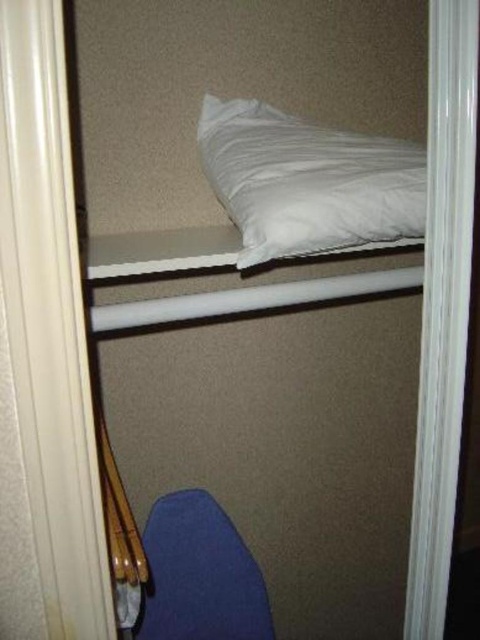
Question: Is blue fabric chair at lower center closer to camera compared to white matte pillow at upper center?

Choices:
 (A) yes
 (B) no

Answer: (B)

Question: Which of the following is the farthest from the observer?

Choices:
 (A) white soft pillow at upper center
 (B) blue fabric chair at lower center
 (C) white matte pillow at upper center

Answer: (B)

Question: In this image, where is white soft pillow at upper center located relative to blue fabric chair at lower center?

Choices:
 (A) right
 (B) left

Answer: (A)

Question: Which object appears farthest from the camera in this image?

Choices:
 (A) blue fabric chair at lower center
 (B) white matte pillow at upper center
 (C) white soft pillow at upper center

Answer: (A)

Question: Does white soft pillow at upper center have a greater width compared to white matte pillow at upper center?

Choices:
 (A) yes
 (B) no

Answer: (B)

Question: Which point is closer to the camera taking this photo?

Choices:
 (A) (219, 134)
 (B) (113, 323)

Answer: (B)